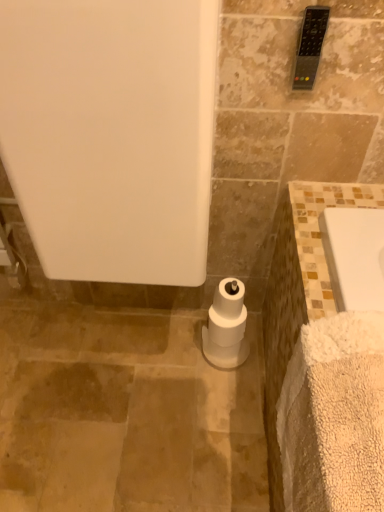
Identify the location of free spot in front of white matte toilet paper at center. The width and height of the screenshot is (384, 512). (226, 399).